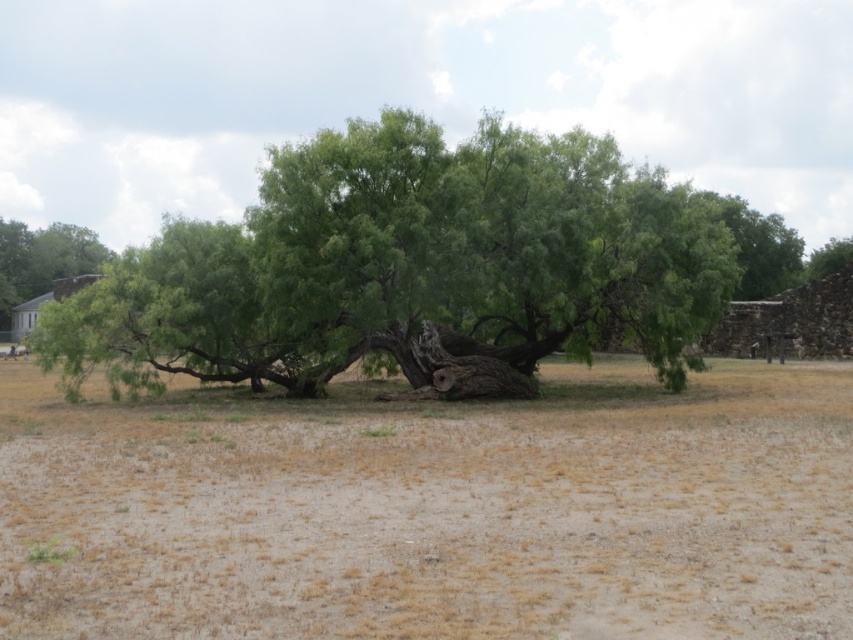
Question: Does green leafy tree at center appear on the right side of brown brick chimney at left?

Choices:
 (A) yes
 (B) no

Answer: (A)

Question: Among these points, which one is nearest to the camera?

Choices:
 (A) (364, 307)
 (B) (4, 262)

Answer: (A)

Question: Which point is farther from the camera taking this photo?

Choices:
 (A) (32, 436)
 (B) (372, 227)
 (C) (7, 328)

Answer: (C)

Question: Considering the real-world distances, which object is farthest from the green leafy tree at center?

Choices:
 (A) brown brick chimney at left
 (B) brown dry grass at center
 (C) green leafy tree at left

Answer: (C)

Question: In this image, where is brown dry grass at center located relative to green leafy tree at center?

Choices:
 (A) above
 (B) below

Answer: (B)

Question: Can you confirm if brown dry grass at center is positioned below brown brick chimney at left?

Choices:
 (A) yes
 (B) no

Answer: (A)